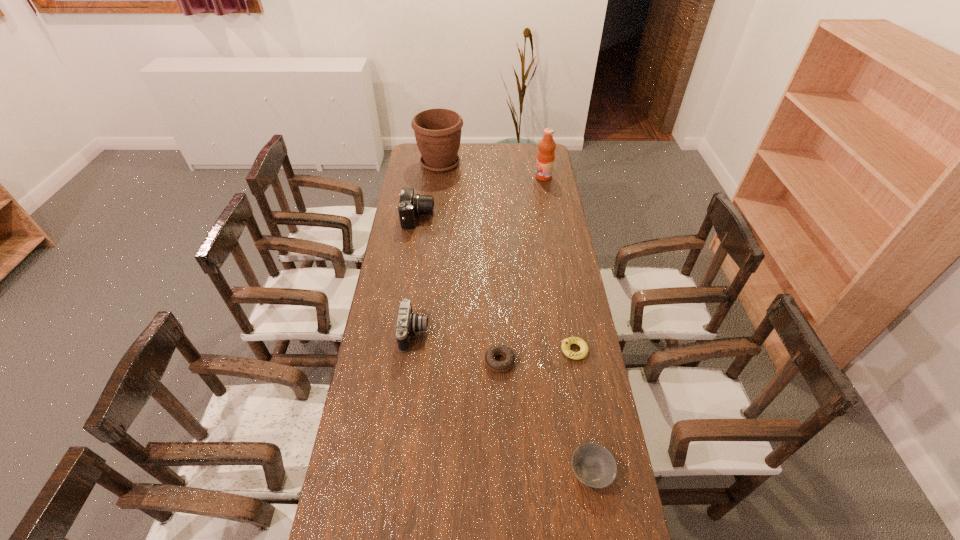
I want to click on object present at the far edge, so pyautogui.click(x=437, y=131).

Find the location of a particular element. The height and width of the screenshot is (540, 960). flowerpot that is at the left edge is located at coordinates (437, 131).

Where is `fruit juice at the right edge`? The width and height of the screenshot is (960, 540). fruit juice at the right edge is located at coordinates (545, 158).

The width and height of the screenshot is (960, 540). What are the coordinates of `duckling that is at the right edge` in the screenshot? It's located at (566, 343).

You are a GUI agent. You are given a task and a screenshot of the screen. Output one action in this format:
    pyautogui.click(x=<x>, y=<y>)
    Task: Click on the bowl located at the right edge
    The width and height of the screenshot is (960, 540).
    Given the screenshot: What is the action you would take?
    pyautogui.click(x=594, y=465)

The image size is (960, 540). I want to click on object present at the far left corner, so click(x=437, y=131).

Identify the location of vacant space at the far edge. (516, 153).

The height and width of the screenshot is (540, 960). Find the location of `free space at the left edge of the desktop`. free space at the left edge of the desktop is located at coordinates (390, 270).

Identify the location of vacant space at the right edge of the desktop. (560, 204).

Locate an element on the screen. vacant space at the far left corner is located at coordinates (416, 148).